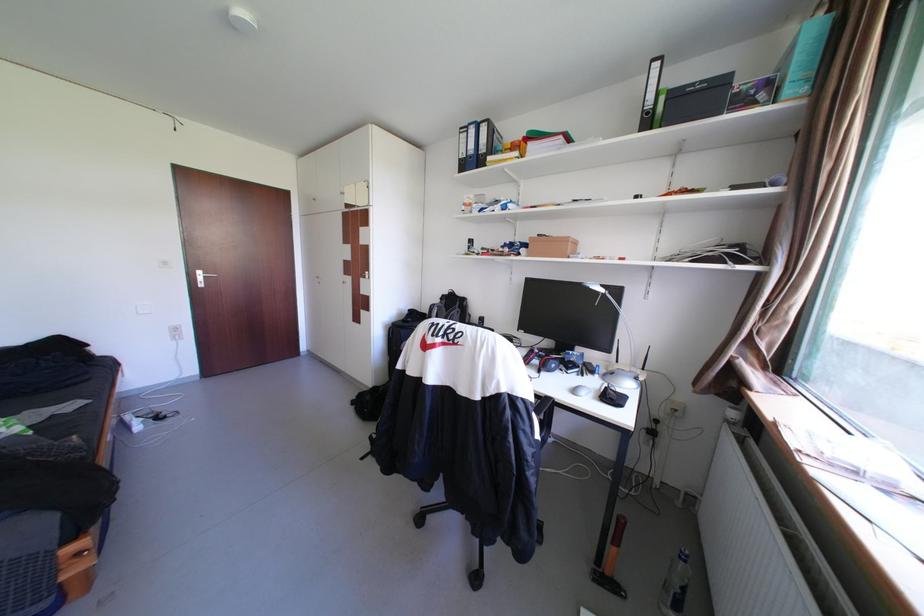
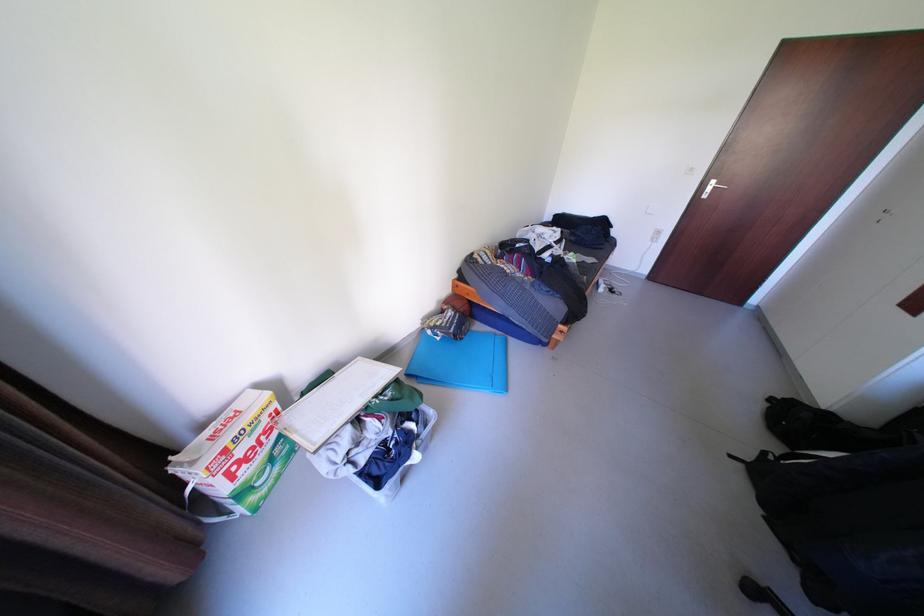
The point at (380, 458) is marked in the first image. Where is the corresponding point in the second image?

(752, 466)